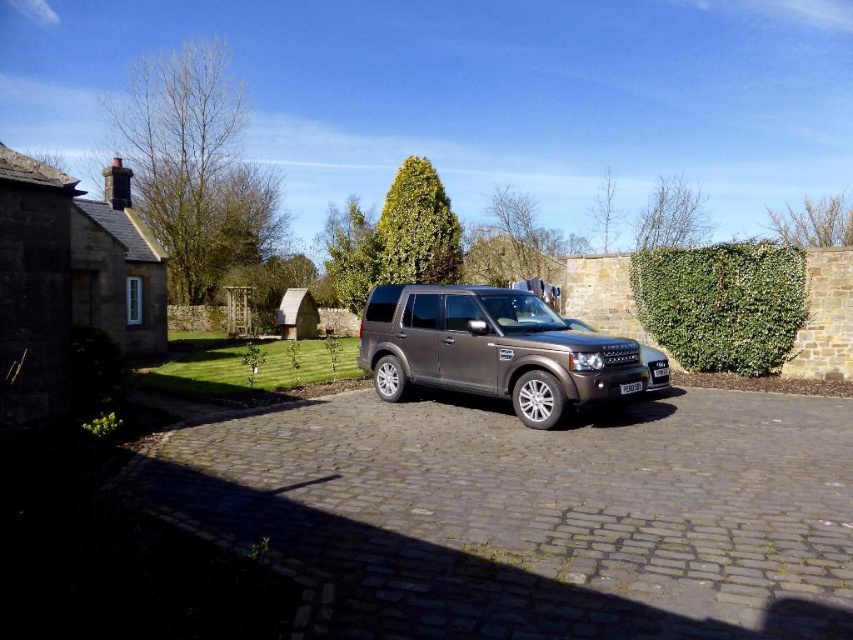
You are standing at the point labeled as point (x=532, y=515) in the image. What object are you currently standing on?

The point (x=532, y=515) corresponds to the brown cobblestone driveway at center.

You are a delivery person who needs to place a 2.5 meter long package on the ground between the brown cobblestone driveway at center and the black plastic license plate at center. Will the package fit in the space between them?

The brown cobblestone driveway at center and black plastic license plate at center are 3.07 meters apart, so a 2.5 meter long package can fit in the space between them since it is shorter than the distance between the two objects.

You are standing at the front of the brown cobblestone driveway at center and want to walk towards the green leafy hedge at right. Which direction should you face to move towards it?

You should face towards the right direction because the brown cobblestone driveway at center is below the green leafy hedge at right, meaning the hedge is located above the driveway in the image.